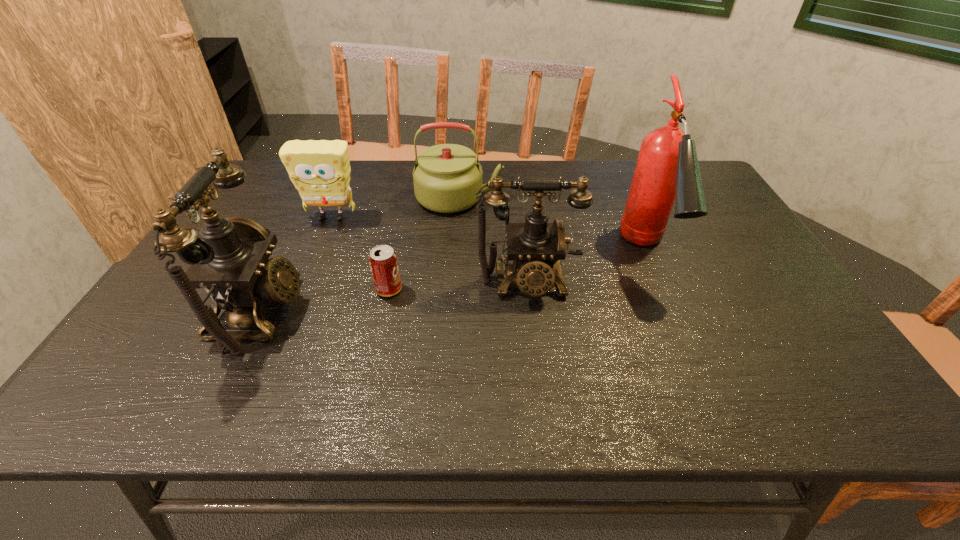
At what (x,y) coordinates should I click in order to perform the action: click on object identified as the closest to the kettle. Please return your answer as a coordinate pair (x, y). Image resolution: width=960 pixels, height=540 pixels. Looking at the image, I should click on (320, 170).

You are a GUI agent. You are given a task and a screenshot of the screen. Output one action in this format:
    pyautogui.click(x=<x>, y=<y>)
    Task: Click on the vacant area in the image that satisfies the following two spatial constraints: 1. on the rotary dial of the right telephone; 2. on the rotary dial of the left telephone
    
    Given the screenshot: What is the action you would take?
    pyautogui.click(x=530, y=312)

Locate an element on the screen. This screenshot has height=540, width=960. free spot that satisfies the following two spatial constraints: 1. on the face of the sponge; 2. on the right side of the soda can is located at coordinates (301, 289).

At what (x,y) coordinates should I click in order to perform the action: click on vacant space that satisfies the following two spatial constraints: 1. on the face of the sponge; 2. on the rotary dial of the left telephone. Please return your answer as a coordinate pair (x, y). The height and width of the screenshot is (540, 960). Looking at the image, I should click on (293, 312).

This screenshot has height=540, width=960. Find the location of `free spot that satisfies the following two spatial constraints: 1. on the face of the shortest object; 2. on the left side of the sponge`. free spot that satisfies the following two spatial constraints: 1. on the face of the shortest object; 2. on the left side of the sponge is located at coordinates (301, 289).

Find the location of a particular element. This screenshot has height=540, width=960. blank area in the image that satisfies the following two spatial constraints: 1. on the rotary dial of the third tallest object; 2. on the rotary dial of the left telephone is located at coordinates (530, 312).

Identify the location of vacant space that satisfies the following two spatial constraints: 1. on the front side of the shortest object; 2. on the rotary dial of the left telephone. (384, 312).